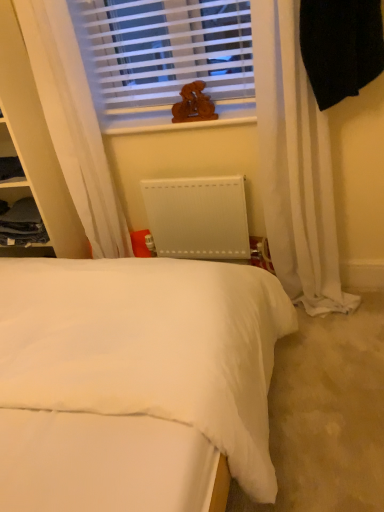
This screenshot has width=384, height=512. Find the location of `empty space that is ontop of wooden carving at upper center`. empty space that is ontop of wooden carving at upper center is located at coordinates 165,116.